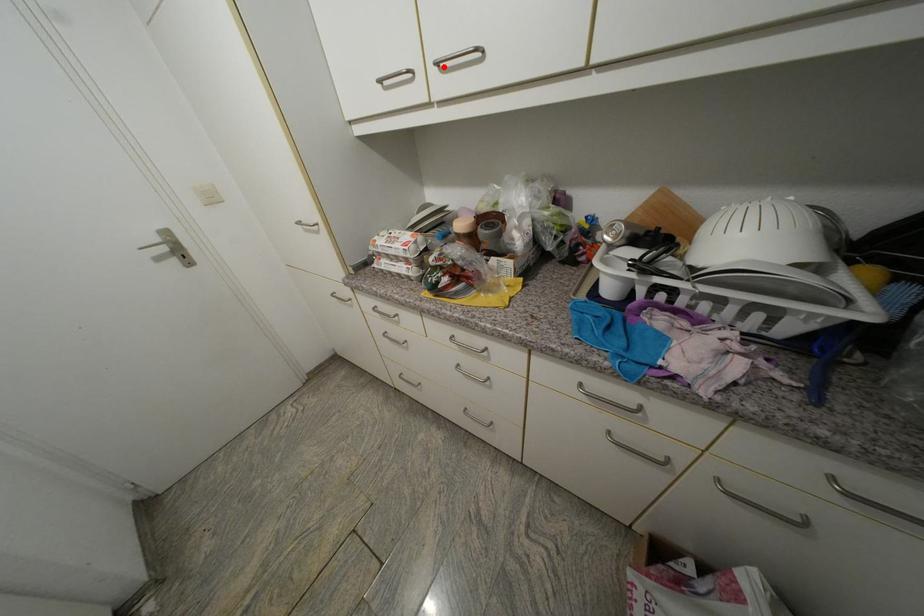
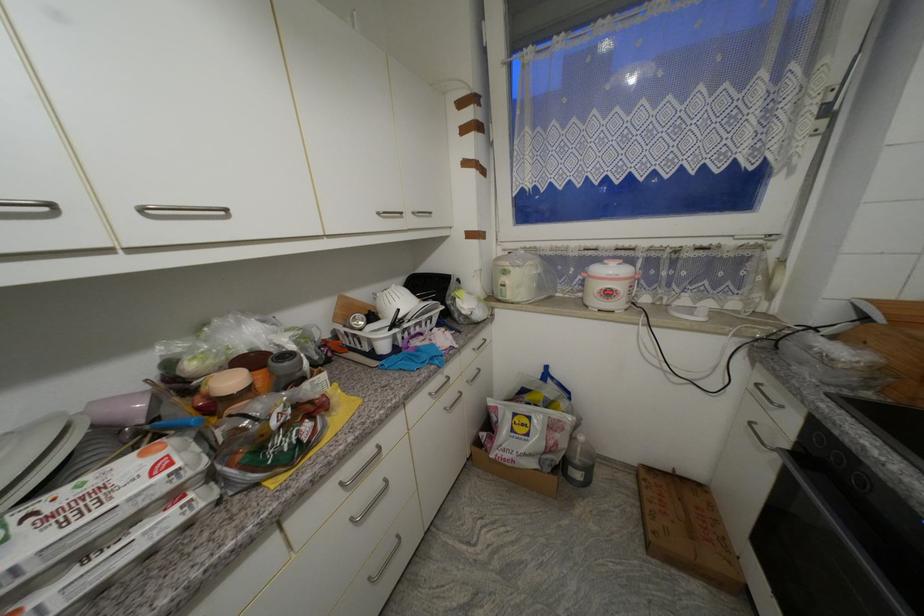
Question: I am providing you with two images of the same scene from different viewpoints. A red point is marked on the first image. Is the red point's position out of view in image 2?

Choices:
 (A) Yes
 (B) No

Answer: (B)